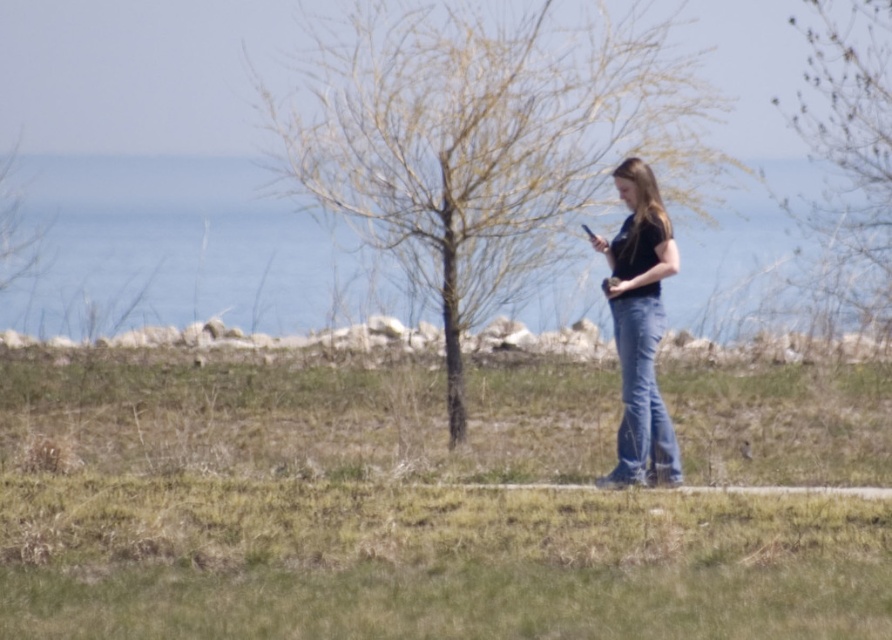
You are a photographer trying to capture the scene of the person in blue denim jeans at center and the tree with bare branches at upper right. To ensure both subjects are in frame, should you adjust your camera to a wider angle or a narrower angle?

You should adjust your camera to a wider angle to ensure both the blue denim jeans at center and the bare branches at upper right are in frame, as the bare branches at upper right are positioned to the right of the blue denim jeans at center, requiring a broader view to capture both.